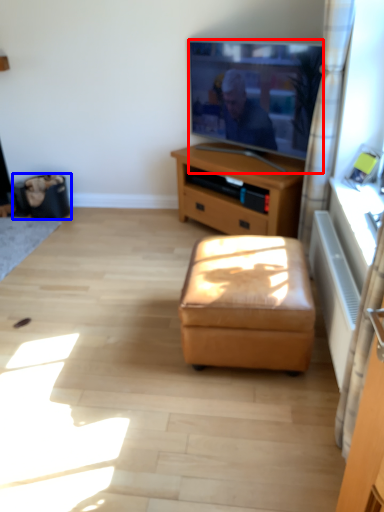
Question: Which of the following is the farthest to the observer, television (highlighted by a red box) or trash bin/can (highlighted by a blue box)?

Choices:
 (A) television
 (B) trash bin/can

Answer: (B)